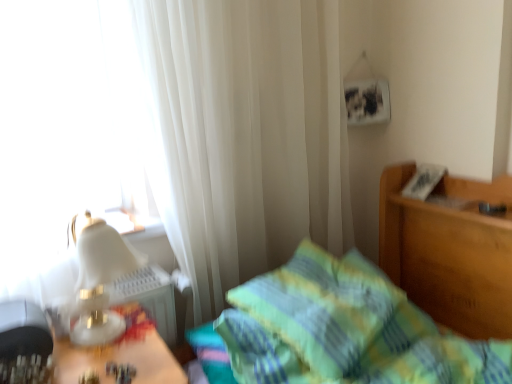
Question: Considering the relative sizes of white sheer curtain at upper left and green plaid bedspread at center in the image provided, is white sheer curtain at upper left taller than green plaid bedspread at center?

Choices:
 (A) no
 (B) yes

Answer: (B)

Question: Considering the relative sizes of white sheer curtain at upper left and green plaid bedspread at center in the image provided, is white sheer curtain at upper left thinner than green plaid bedspread at center?

Choices:
 (A) yes
 (B) no

Answer: (A)

Question: Does white sheer curtain at upper left have a larger size compared to green plaid bedspread at center?

Choices:
 (A) yes
 (B) no

Answer: (B)

Question: Is white sheer curtain at upper left further to camera compared to green plaid bedspread at center?

Choices:
 (A) no
 (B) yes

Answer: (B)

Question: Is white sheer curtain at upper left far away from green plaid bedspread at center?

Choices:
 (A) no
 (B) yes

Answer: (A)

Question: From a real-world perspective, is white sheer curtain at upper left physically above green plaid bedspread at center?

Choices:
 (A) no
 (B) yes

Answer: (B)

Question: Considering the relative sizes of white glossy table lamp at left and white sheer curtain at upper left in the image provided, is white glossy table lamp at left wider than white sheer curtain at upper left?

Choices:
 (A) no
 (B) yes

Answer: (B)

Question: Is white glossy table lamp at left positioned with its back to white sheer curtain at upper left?

Choices:
 (A) yes
 (B) no

Answer: (B)

Question: Can you confirm if white glossy table lamp at left is taller than white sheer curtain at upper left?

Choices:
 (A) no
 (B) yes

Answer: (A)

Question: Does white glossy table lamp at left lie behind white sheer curtain at upper left?

Choices:
 (A) yes
 (B) no

Answer: (B)

Question: Is white glossy table lamp at left closer to camera compared to white sheer curtain at upper left?

Choices:
 (A) no
 (B) yes

Answer: (B)

Question: Is white sheer curtain at upper left located within white glossy table lamp at left?

Choices:
 (A) no
 (B) yes

Answer: (A)

Question: Is green plaid bedspread at center oriented towards green plaid pillow at center?

Choices:
 (A) no
 (B) yes

Answer: (B)